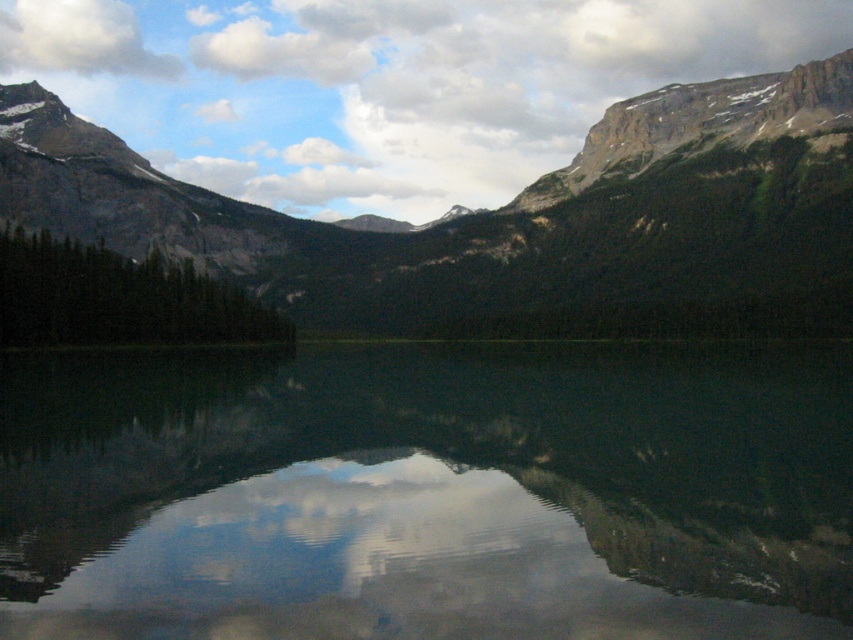
You are standing at the origin point in the scene. Where is the transparent glass water at center located in terms of its 2D coordinates?

The transparent glass water at center is located at the 2D coordinates of point (428, 492).

You are standing at the lakeside and want to take a photo of both the transparent glass water at center and the rocky mountain range at center. Which object will appear larger in your camera viewfinder?

The transparent glass water at center will appear larger in the camera viewfinder because it is closer to the viewer than the rocky mountain range at center.

Based on the scene description, which object is smaller in size between the transparent glass water at center and the rocky mountain range at center?

The transparent glass water at center is smaller in size compared to the rocky mountain range at center according to the description.